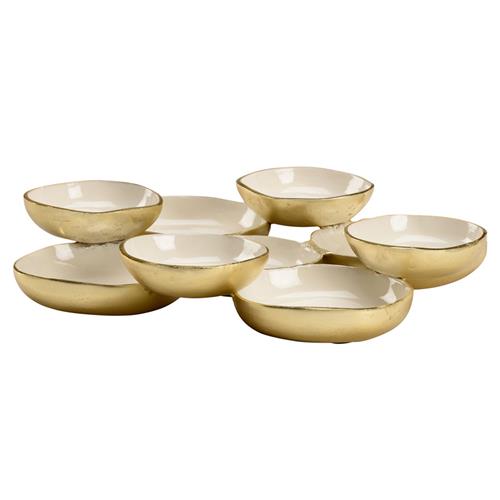
The height and width of the screenshot is (500, 500). What are the coordinates of `the left side bowls` in the screenshot? It's located at (86, 208), (95, 276).